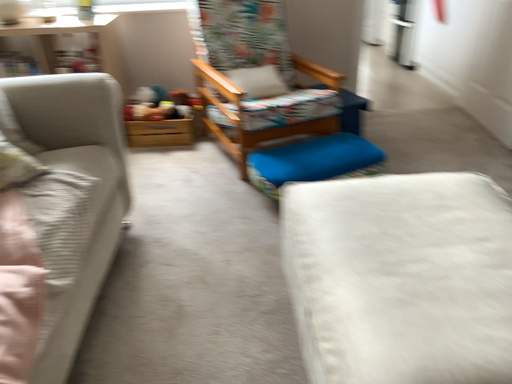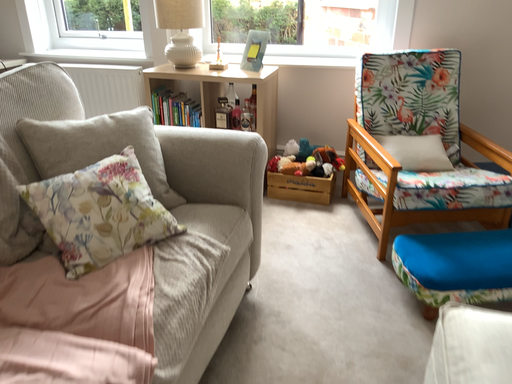
Question: How did the camera likely rotate when shooting the video?

Choices:
 (A) rotated upward
 (B) rotated downward

Answer: (A)